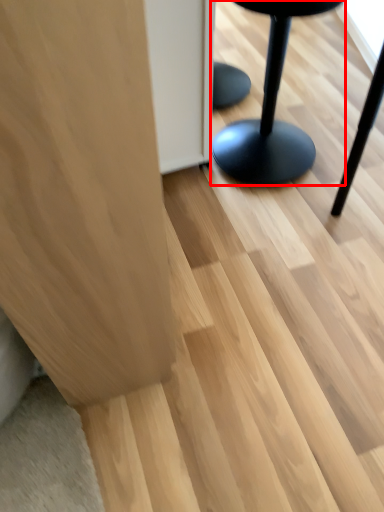
Question: From the image's perspective, what is the correct spatial positioning of furniture (annotated by the red box) in reference to furniture?

Choices:
 (A) below
 (B) above

Answer: (B)